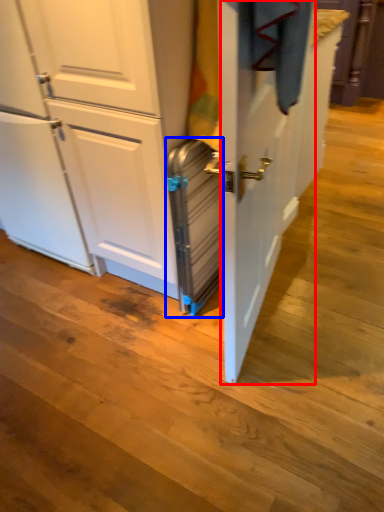
Question: Which of the following is the closest to the observer, screen door (highlighted by a red box) or appliance (highlighted by a blue box)?

Choices:
 (A) screen door
 (B) appliance

Answer: (A)